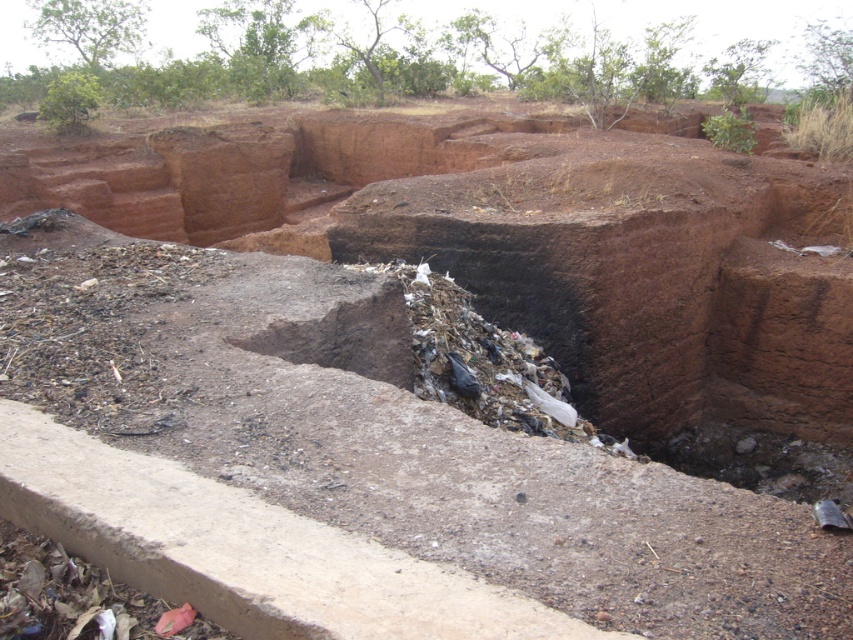
Question: From the image, what is the correct spatial relationship of black plastic bags at center in relation to dark brown dirt at lower right?

Choices:
 (A) right
 (B) left

Answer: (B)

Question: Which of the following is the closest to the observer?

Choices:
 (A) black plastic bags at center
 (B) dark brown dirt at lower right

Answer: (A)

Question: From the image, what is the correct spatial relationship of black plastic bags at center in relation to dark brown dirt at lower right?

Choices:
 (A) below
 (B) above

Answer: (B)

Question: Can you confirm if black plastic bags at center is positioned below dark brown dirt at lower right?

Choices:
 (A) no
 (B) yes

Answer: (A)

Question: Which point is farther to the camera?

Choices:
 (A) (804, 452)
 (B) (525, 342)

Answer: (A)

Question: Which point is farther from the camera taking this photo?

Choices:
 (A) pyautogui.click(x=625, y=445)
 (B) pyautogui.click(x=734, y=448)

Answer: (B)